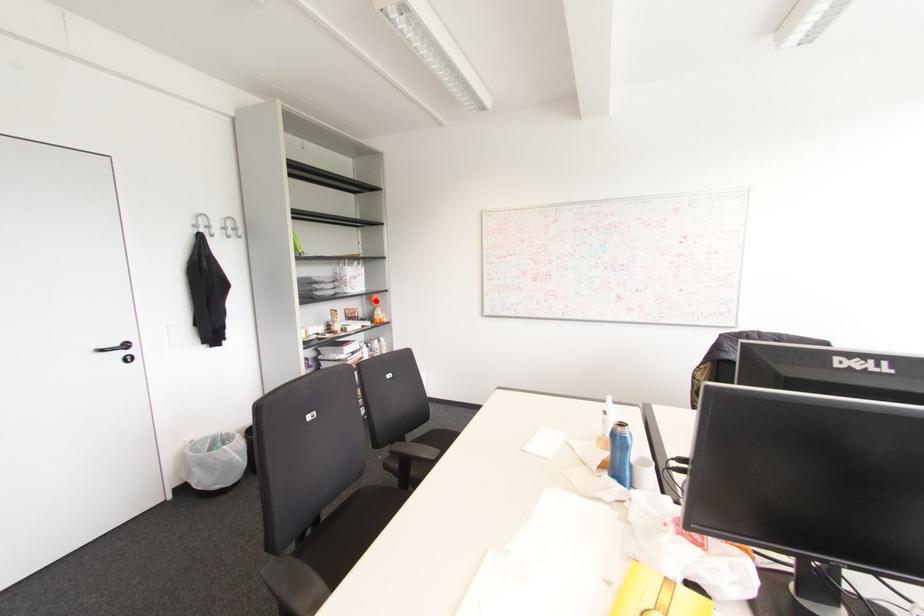
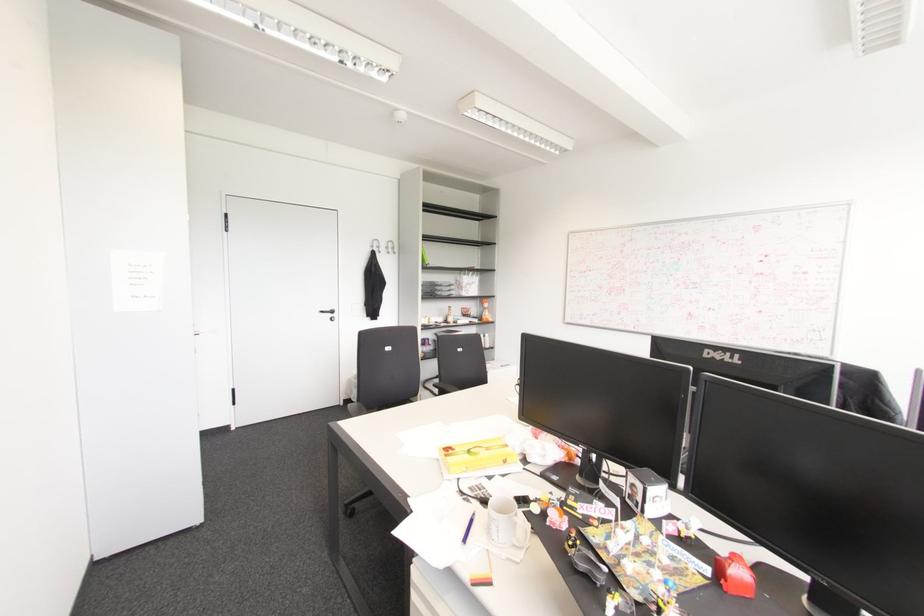
Where in the second image is the point corresponding to the highlighted location from the first image?

(485, 305)